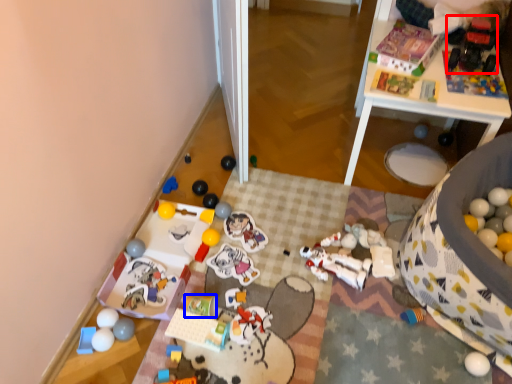
Question: Which object appears closest to the camera in this image, toy (highlighted by a red box) or toy (highlighted by a blue box)?

Choices:
 (A) toy
 (B) toy

Answer: (B)